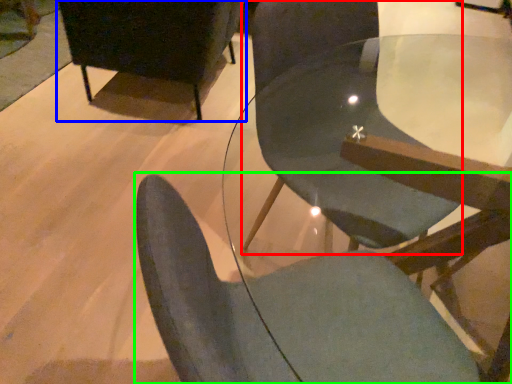
Question: Which is farther away from chair (highlighted by a red box)? chair (highlighted by a blue box) or chair (highlighted by a green box)?

Choices:
 (A) chair
 (B) chair

Answer: (A)